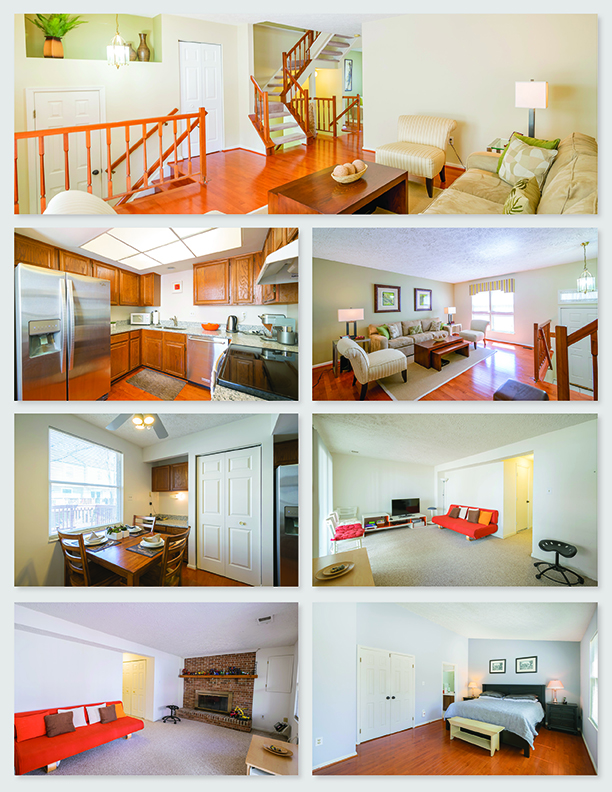
In order to click on room pictures in this screenshot , I will do `click(203, 680)`, `click(371, 680)`, `click(415, 503)`, `click(174, 489)`, `click(181, 343)`, `click(401, 314)`, `click(415, 153)`.